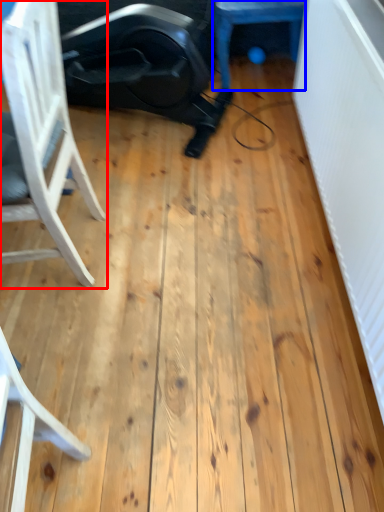
Question: Which point is closer to the camera, chair (highlighted by a red box) or furniture (highlighted by a blue box)?

Choices:
 (A) chair
 (B) furniture

Answer: (A)